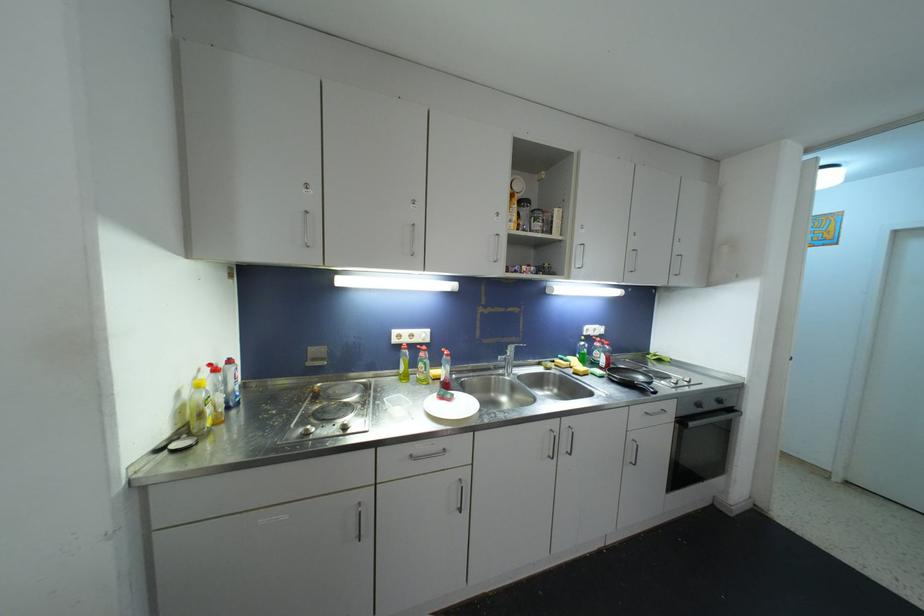
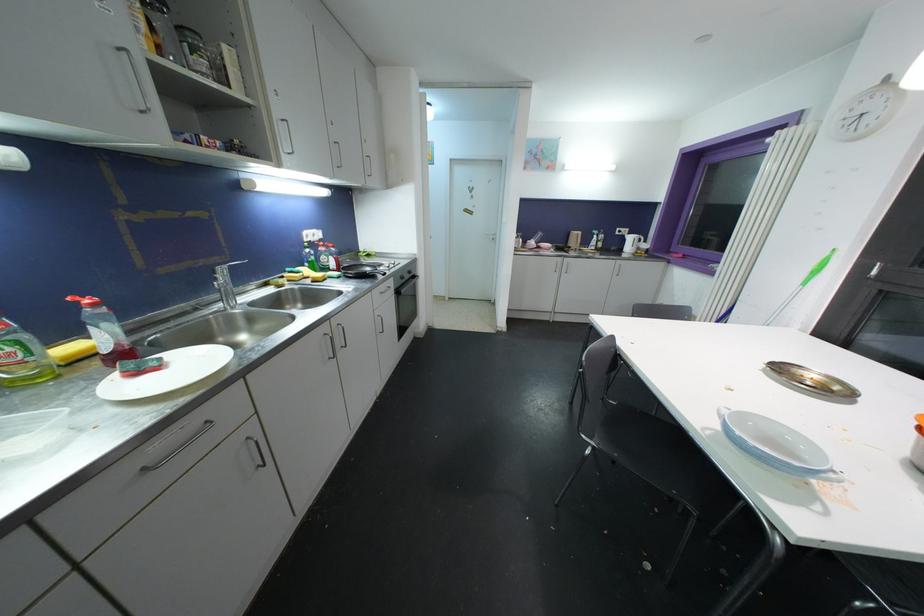
In the second image, find the point that corresponds to [431,363] in the first image.

(27, 339)